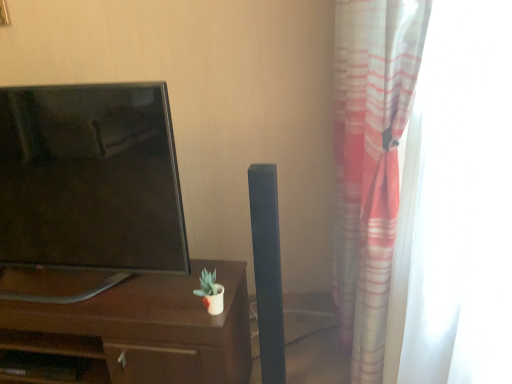
Question: Could translucent fabric curtain at right be considered to be inside brown wood desk at center?

Choices:
 (A) yes
 (B) no

Answer: (B)

Question: From a real-world perspective, is brown wood desk at center under translucent fabric curtain at right?

Choices:
 (A) no
 (B) yes

Answer: (B)

Question: Is brown wood desk at center to the right of translucent fabric curtain at right from the viewer's perspective?

Choices:
 (A) yes
 (B) no

Answer: (B)

Question: Are brown wood desk at center and translucent fabric curtain at right beside each other?

Choices:
 (A) yes
 (B) no

Answer: (B)

Question: Is translucent fabric curtain at right at the back of brown wood desk at center?

Choices:
 (A) yes
 (B) no

Answer: (B)

Question: In the image, is brown wood desk at center positioned in front of or behind matte black tv at left?

Choices:
 (A) behind
 (B) front

Answer: (A)

Question: In the image, is brown wood desk at center on the left side or the right side of matte black tv at left?

Choices:
 (A) left
 (B) right

Answer: (A)

Question: From a real-world perspective, is brown wood desk at center above or below matte black tv at left?

Choices:
 (A) below
 (B) above

Answer: (A)

Question: Is brown wood desk at center wider or thinner than matte black tv at left?

Choices:
 (A) thin
 (B) wide

Answer: (B)

Question: From the image's perspective, is matte black tv at left located above or below brown wood desk at center?

Choices:
 (A) above
 (B) below

Answer: (A)

Question: Based on their positions, is matte black tv at left located to the left or right of brown wood desk at center?

Choices:
 (A) right
 (B) left

Answer: (A)

Question: Considering the positions of point (62, 177) and point (47, 317), is point (62, 177) closer or farther from the camera than point (47, 317)?

Choices:
 (A) closer
 (B) farther

Answer: (A)

Question: Looking at their shapes, would you say matte black tv at left is wider or thinner than brown wood desk at center?

Choices:
 (A) thin
 (B) wide

Answer: (A)

Question: Relative to brown wood desk at center, is translucent fabric curtain at right in front or behind?

Choices:
 (A) front
 (B) behind

Answer: (A)

Question: In terms of size, does translucent fabric curtain at right appear bigger or smaller than brown wood desk at center?

Choices:
 (A) small
 (B) big

Answer: (B)